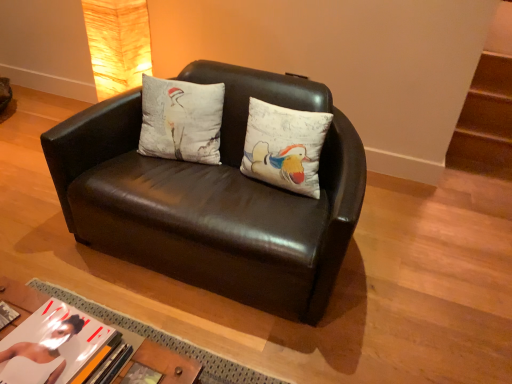
What do you see at coordinates (54, 346) in the screenshot? Image resolution: width=512 pixels, height=384 pixels. I see `matte paper book at lower left, arranged as the first book when viewed from the left` at bounding box center [54, 346].

The height and width of the screenshot is (384, 512). What are the coordinates of `white cotton cushion at center` in the screenshot? It's located at (181, 120).

Where is `matte black couch at center`? This screenshot has width=512, height=384. matte black couch at center is located at coordinates (213, 197).

At what (x,y) coordinates should I click in order to perform the action: click on studio couch that appears below the matte paper book at lower left, arranged as the first book when viewed from the left (from a real-world perspective). Please return your answer as a coordinate pair (x, y). Looking at the image, I should click on (213, 197).

Considering the sizes of matte paper book at lower left, which is the second book in right-to-left order, and matte black couch at center in the image, is matte paper book at lower left, which is the second book in right-to-left order, taller or shorter than matte black couch at center?

Clearly, matte paper book at lower left, which is the second book in right-to-left order, is shorter compared to matte black couch at center.

Is matte paper book at lower left, arranged as the first book when viewed from the left, looking in the opposite direction of matte black couch at center?

No.

In the image, is matte beige lampshade at upper left on the left side or the right side of white cotton cushion at center?

In the image, matte beige lampshade at upper left appears on the left side of white cotton cushion at center.

Considering the sizes of objects matte beige lampshade at upper left and white cotton cushion at center in the image provided, who is bigger, matte beige lampshade at upper left or white cotton cushion at center?

matte beige lampshade at upper left is bigger.

Is point (105, 1) positioned after point (219, 104)?

Yes, point (105, 1) is farther from viewer.

Is matte paper book at lower left, which is the second book in right-to-left order, inside or outside of white cotton cushion at center?

The correct answer is: outside.

Considering the points (13, 335) and (196, 106), which point is in front, point (13, 335) or point (196, 106)?

The point (13, 335) is closer to the camera.

Can you see matte paper book at lower left, which is the second book in right-to-left order, touching hardcover book at lower center, placed as the second book when sorted from left to right?

There is a gap between matte paper book at lower left, which is the second book in right-to-left order, and hardcover book at lower center, placed as the second book when sorted from left to right.

Considering the sizes of matte paper book at lower left, arranged as the first book when viewed from the left, and hardcover book at lower center, placed as the second book when sorted from left to right, in the image, is matte paper book at lower left, arranged as the first book when viewed from the left, bigger or smaller than hardcover book at lower center, placed as the second book when sorted from left to right,?

matte paper book at lower left, arranged as the first book when viewed from the left, is bigger than hardcover book at lower center, placed as the second book when sorted from left to right.

What's the angular difference between matte paper book at lower left, arranged as the first book when viewed from the left, and hardcover book at lower center, placed as the second book when sorted from left to right,'s facing directions?

The angle between the facing direction of matte paper book at lower left, arranged as the first book when viewed from the left, and the facing direction of hardcover book at lower center, placed as the second book when sorted from left to right, is 0.00155 degrees.

Which object is positioned more to the left, matte paper book at lower left, which is the second book in right-to-left order, or hardcover book at lower center, placed as the 1th book when sorted from right to left?

matte paper book at lower left, which is the second book in right-to-left order, is more to the left.

Is matte beige lampshade at upper left taller or shorter than matte black couch at center?

In the image, matte beige lampshade at upper left appears to be shorter than matte black couch at center.

From the image's perspective, is matte beige lampshade at upper left located above or below matte black couch at center?

From the image's perspective, matte beige lampshade at upper left appears above matte black couch at center.

Looking at this image, does matte beige lampshade at upper left touch matte black couch at center?

No, matte beige lampshade at upper left is not with matte black couch at center.

Is there a large distance between white cotton cushion at center and matte black couch at center?

No, there isn't a large distance between white cotton cushion at center and matte black couch at center.

Is white cotton cushion at center to the left of matte black couch at center from the viewer's perspective?

Yes.

Is point (145, 125) in front of point (328, 294)?

That is False.

Which of these two, matte paper book at lower left, which is the second book in right-to-left order, or matte beige lampshade at upper left, is wider?

matte beige lampshade at upper left.

Between matte paper book at lower left, which is the second book in right-to-left order, and matte beige lampshade at upper left, which one has smaller size?

With smaller size is matte paper book at lower left, which is the second book in right-to-left order.

Is matte paper book at lower left, arranged as the first book when viewed from the left, placed right next to matte beige lampshade at upper left?

No.

From the picture: Does matte paper book at lower left, which is the second book in right-to-left order, have a greater height compared to matte beige lampshade at upper left?

No.

From the image's perspective, count 1st books downward from the matte black couch at center and point to it. Please provide its 2D coordinates.

[(54, 346)]

Identify the location of lamp behind the white cotton cushion at center. (117, 44).

Which object lies nearer to the anchor point matte beige lampshade at upper left, matte black couch at center or hardcover book at lower center, placed as the 1th book when sorted from right to left?

Among the two, matte black couch at center is located nearer to matte beige lampshade at upper left.

From the image, which object appears to be farther from white cotton cushion at center, matte beige lampshade at upper left or matte black couch at center?

Based on the image, matte beige lampshade at upper left appears to be further to white cotton cushion at center.

From the image, which object appears to be nearer to matte black couch at center, white cotton cushion at center or matte paper book at lower left, which is the second book in right-to-left order?

Among the two, white cotton cushion at center is located nearer to matte black couch at center.

Based on their spatial positions, is matte beige lampshade at upper left or matte paper book at lower left, which is the second book in right-to-left order, further from white cotton cushion at center?

matte paper book at lower left, which is the second book in right-to-left order, lies further to white cotton cushion at center than the other object.

Estimate the real-world distances between objects in this image. Which object is further from matte paper book at lower left, arranged as the first book when viewed from the left, hardcover book at lower center, placed as the second book when sorted from left to right, or matte black couch at center?

The object further to matte paper book at lower left, arranged as the first book when viewed from the left, is matte black couch at center.

When comparing their distances from hardcover book at lower center, placed as the second book when sorted from left to right, does matte black couch at center or matte paper book at lower left, which is the second book in right-to-left order, seem further?

matte black couch at center is positioned further to the anchor hardcover book at lower center, placed as the second book when sorted from left to right.

Estimate the real-world distances between objects in this image. Which object is closer to white cotton cushion at center, matte black couch at center or matte beige lampshade at upper left?

Among the two, matte black couch at center is located nearer to white cotton cushion at center.

Based on their spatial positions, is matte paper book at lower left, which is the second book in right-to-left order, or hardcover book at lower center, placed as the second book when sorted from left to right, closer to white cotton cushion at center?

Among the two, matte paper book at lower left, which is the second book in right-to-left order, is located nearer to white cotton cushion at center.

You are a GUI agent. You are given a task and a screenshot of the screen. Output one action in this format:
    pyautogui.click(x=<x>, y=<y>)
    Task: Click on the pillow between matte beige lampshade at upper left and hardcover book at lower center, placed as the second book when sorted from left to right, vertically
    
    Given the screenshot: What is the action you would take?
    pyautogui.click(x=181, y=120)

This screenshot has height=384, width=512. I want to click on studio couch between matte paper book at lower left, which is the second book in right-to-left order, and matte beige lampshade at upper left in the front-back direction, so click(x=213, y=197).

Image resolution: width=512 pixels, height=384 pixels. Find the location of `book located between matte paper book at lower left, arranged as the first book when viewed from the left, and white cotton cushion at center in the depth direction`. book located between matte paper book at lower left, arranged as the first book when viewed from the left, and white cotton cushion at center in the depth direction is located at coordinates (141, 375).

Where is `studio couch between white cotton cushion at center and hardcover book at lower center, placed as the 1th book when sorted from right to left, in the vertical direction`? This screenshot has height=384, width=512. studio couch between white cotton cushion at center and hardcover book at lower center, placed as the 1th book when sorted from right to left, in the vertical direction is located at coordinates (213, 197).